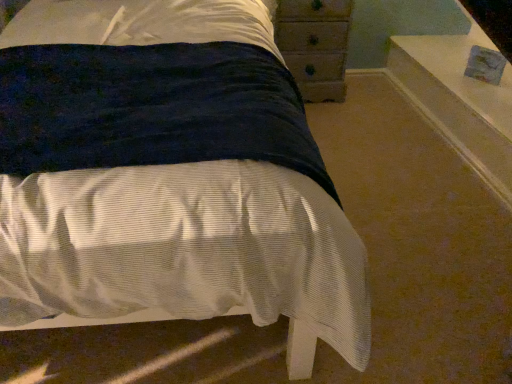
Locate an element on the screen. Image resolution: width=512 pixels, height=384 pixels. vacant space in front of wooden chest of drawers at upper right is located at coordinates (337, 123).